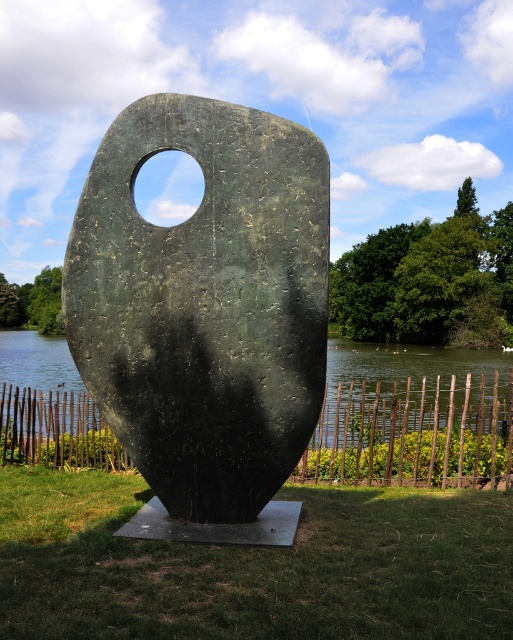
Question: Observing the image, what is the correct spatial positioning of bronze textured stone at center in reference to green metallic water at center?

Choices:
 (A) above
 (B) below

Answer: (A)

Question: Can you confirm if bronze textured stone at center is positioned above green metallic water at center?

Choices:
 (A) no
 (B) yes

Answer: (B)

Question: Among these points, which one is farthest from the camera?

Choices:
 (A) (84, 518)
 (B) (146, 116)

Answer: (A)

Question: Is bronze textured stone at center closer to camera compared to green grass at center?

Choices:
 (A) yes
 (B) no

Answer: (B)

Question: Which point is farther to the camera?

Choices:
 (A) (205, 520)
 (B) (445, 362)

Answer: (B)

Question: Which of these objects is positioned closest to the bronze textured stone at center?

Choices:
 (A) green grass at center
 (B) green metallic water at center

Answer: (A)